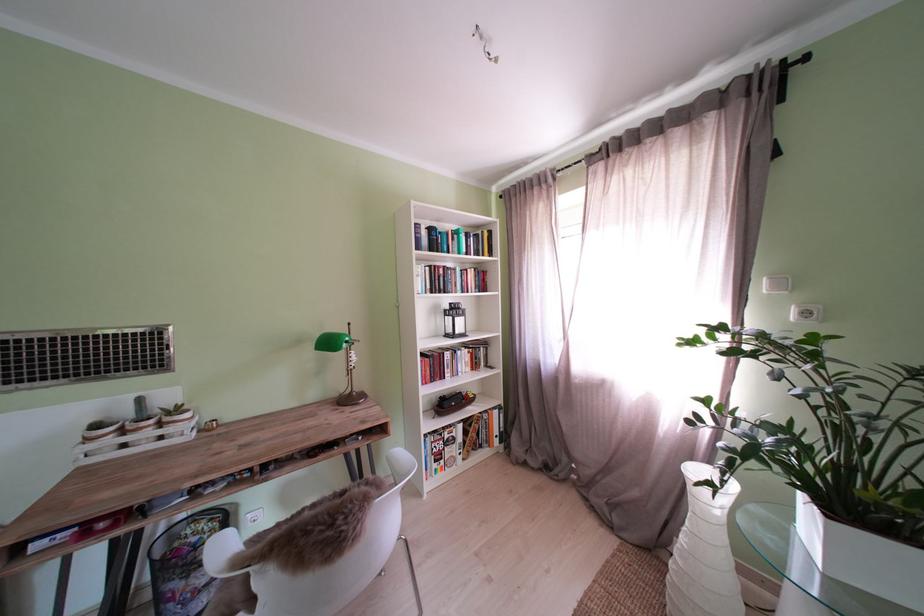
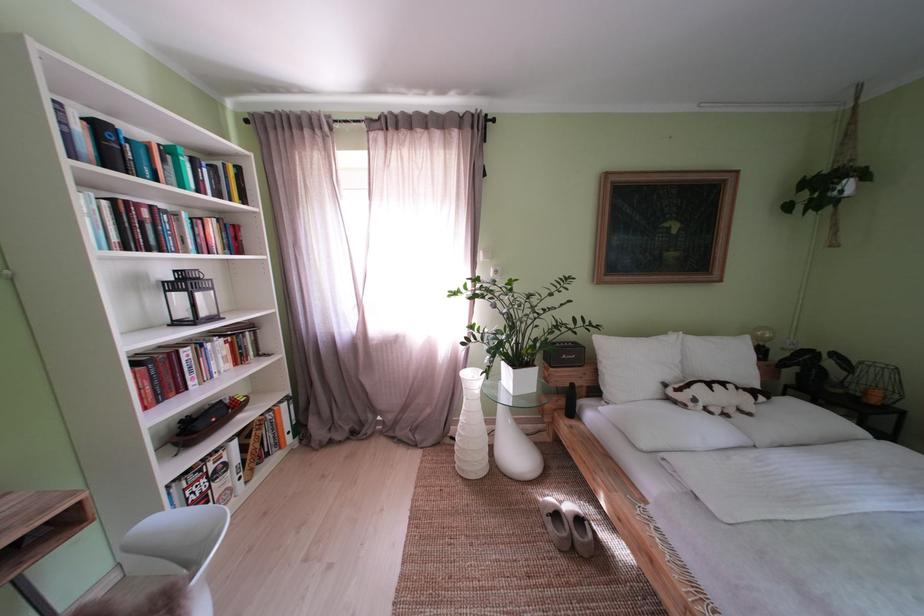
Find the pixel in the second image that matches (442,235) in the first image.

(111, 132)